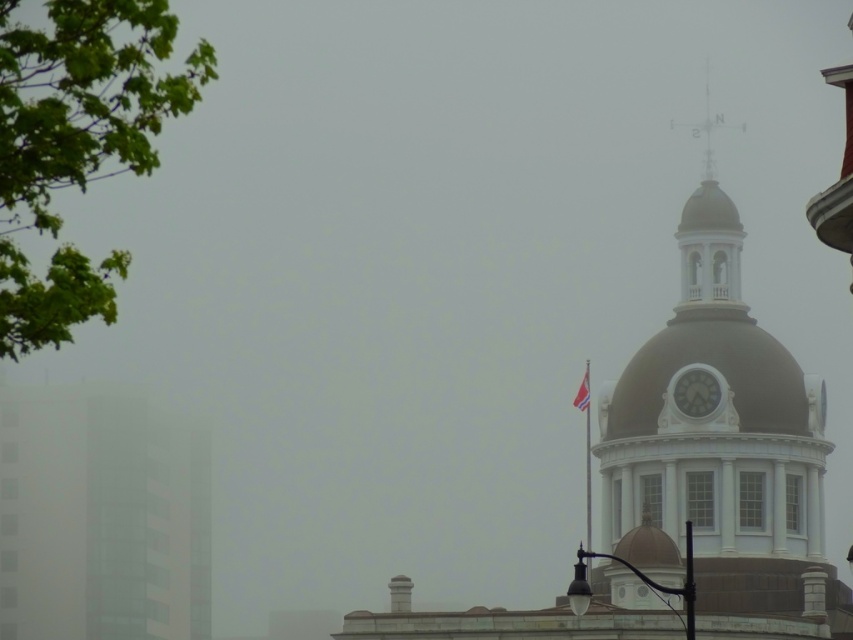
Describe the element at coordinates (720, 435) in the screenshot. I see `white stone clock tower at upper right` at that location.

Is white stone clock tower at upper right smaller than white fabric flag at upper center?

Actually, white stone clock tower at upper right might be larger than white fabric flag at upper center.

What do you see at coordinates (720, 435) in the screenshot? I see `white stone clock tower at upper right` at bounding box center [720, 435].

You are a GUI agent. You are given a task and a screenshot of the screen. Output one action in this format:
    pyautogui.click(x=<x>, y=<y>)
    Task: Click on the white stone clock tower at upper right
    
    Given the screenshot: What is the action you would take?
    pyautogui.click(x=720, y=435)

Can you confirm if white stone clock tower at upper right is shorter than white glossy clock at upper right?

No.

Which of these two, white stone clock tower at upper right or white glossy clock at upper right, stands taller?

white stone clock tower at upper right is taller.

Does point (717, 470) come in front of point (692, 369)?

Yes, it is.

Find the location of a particular element. The height and width of the screenshot is (640, 853). white stone clock tower at upper right is located at coordinates (720, 435).

Is white glossy clock at upper right thinner than white fabric flag at upper center?

No.

Between white glossy clock at upper right and white fabric flag at upper center, which one is positioned higher?

white glossy clock at upper right is higher up.

This screenshot has width=853, height=640. Describe the element at coordinates (695, 392) in the screenshot. I see `white glossy clock at upper right` at that location.

Where is `white glossy clock at upper right`? white glossy clock at upper right is located at coordinates (695, 392).